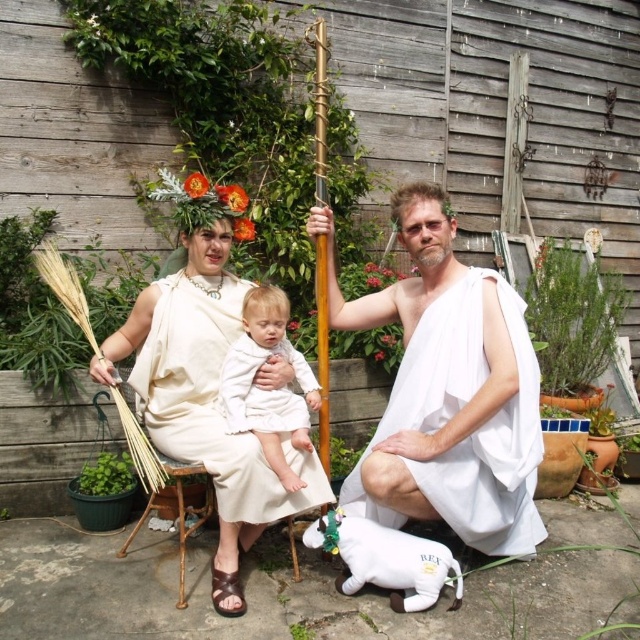
Question: Does white cloth toga at center appear on the right side of matte white toga at center?

Choices:
 (A) yes
 (B) no

Answer: (A)

Question: Which object appears farthest from the camera in this image?

Choices:
 (A) white soft fabric baby at center
 (B) white cloth toga at center

Answer: (A)

Question: Can you confirm if white cloth toga at center is smaller than matte white toga at center?

Choices:
 (A) no
 (B) yes

Answer: (A)

Question: Which object appears farthest from the camera in this image?

Choices:
 (A) white soft fabric baby at center
 (B) white cloth toga at center

Answer: (A)

Question: Which object is positioned closest to the white cloth toga at center?

Choices:
 (A) matte white toga at center
 (B) white soft fabric baby at center

Answer: (B)

Question: Does matte white toga at center have a lesser width compared to white soft fabric baby at center?

Choices:
 (A) no
 (B) yes

Answer: (A)